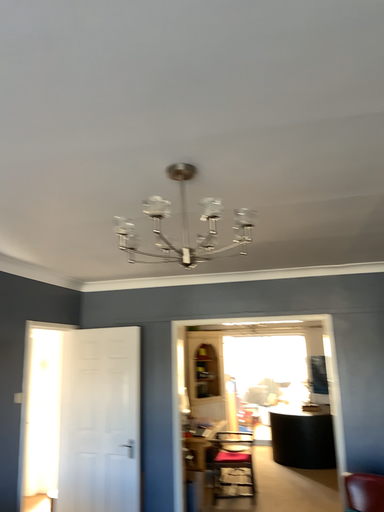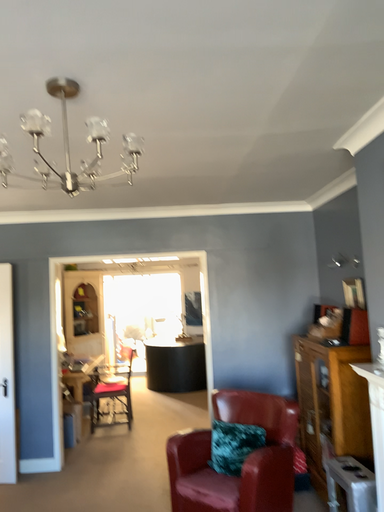
Question: Which way did the camera rotate in the video?

Choices:
 (A) rotated left
 (B) rotated right

Answer: (B)